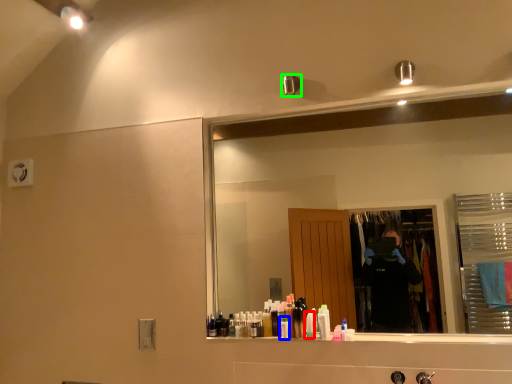
Question: Considering the real-world distances, which object is closest to toiletry (highlighted by a red box)? toiletry (highlighted by a blue box) or shower (highlighted by a green box).

Choices:
 (A) toiletry
 (B) shower

Answer: (A)